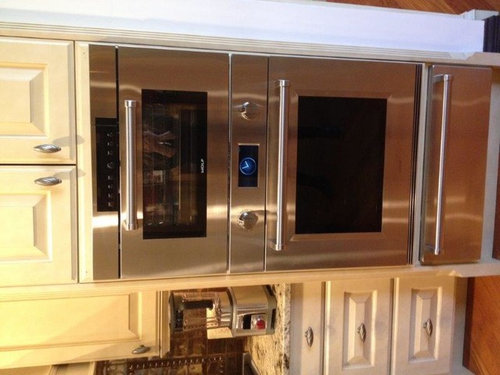
What are the coordinates of `convection oven` in the screenshot? It's located at (175, 182).